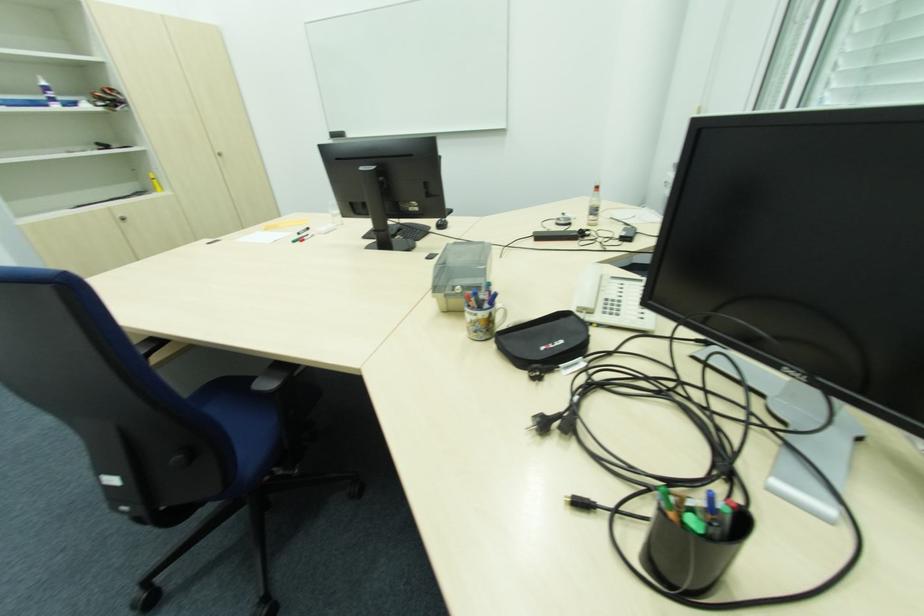
The location [543,341] corresponds to which object?

This point indicates the black zipper pouch.